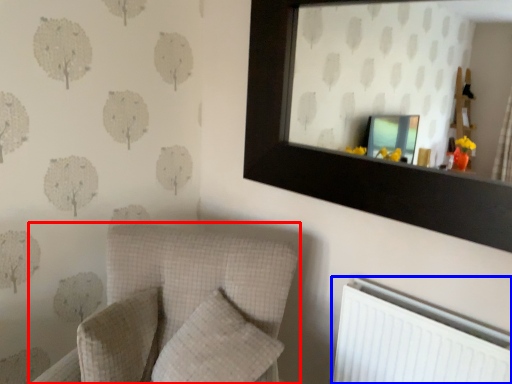
Question: Which point is further to the camera, furniture (highlighted by a red box) or radiator (highlighted by a blue box)?

Choices:
 (A) furniture
 (B) radiator

Answer: (B)